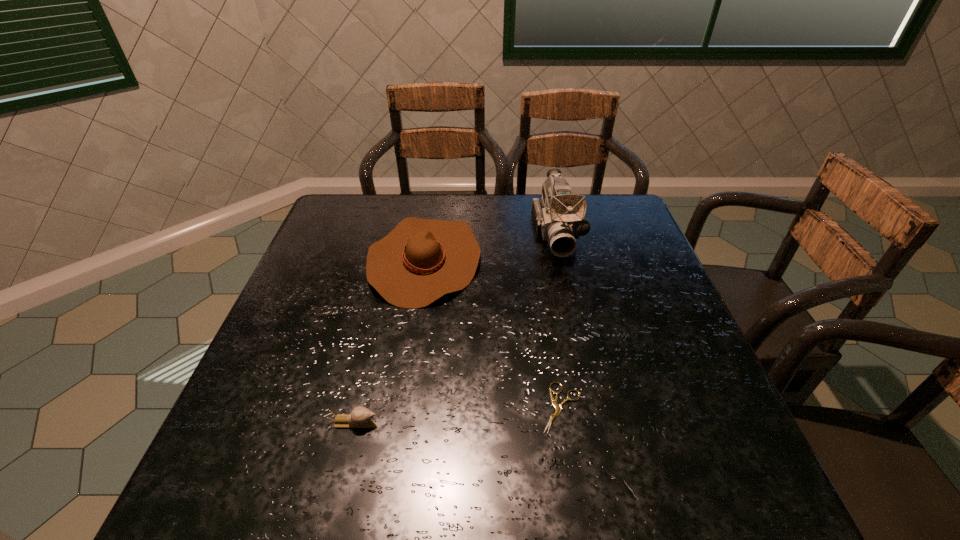
At what (x,y) coordinates should I click in order to perform the action: click on the tallest object. Please return your answer as a coordinate pair (x, y). This screenshot has height=540, width=960. Looking at the image, I should click on (559, 218).

What are the coordinates of `the third shortest object` in the screenshot? It's located at coord(420,260).

This screenshot has height=540, width=960. I want to click on the second shortest object, so click(x=360, y=417).

This screenshot has height=540, width=960. Find the location of `the shortest object`. the shortest object is located at coordinates (558, 407).

Identify the location of vacant space located 0.280m on the front-facing side of the camcorder. The image size is (960, 540). (582, 344).

Locate an element on the screen. The image size is (960, 540). vacant space located on the right of the cowboy hat is located at coordinates (628, 259).

I want to click on free location located 0.260m on the shell of the escargot, so click(517, 423).

Locate an element on the screen. free spot located 0.170m on the right of the shears is located at coordinates (671, 408).

You are a GUI agent. You are given a task and a screenshot of the screen. Output one action in this format:
    pyautogui.click(x=<x>, y=<y>)
    Task: Click on the camcorder located at the far edge
    This screenshot has width=960, height=540.
    Given the screenshot: What is the action you would take?
    pyautogui.click(x=559, y=218)

At what (x,y) coordinates should I click in order to perform the action: click on cowboy hat situated at the far edge. Please return your answer as a coordinate pair (x, y). The height and width of the screenshot is (540, 960). Looking at the image, I should click on (420, 260).